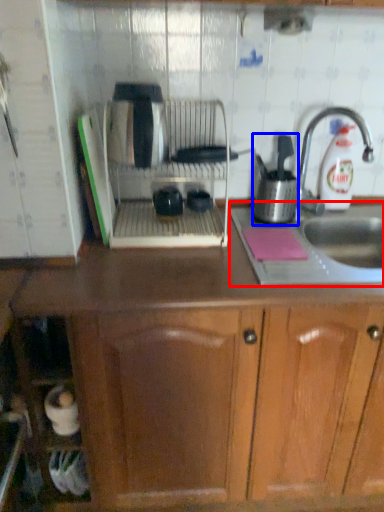
Question: Which object is closer to the camera taking this photo, sink (highlighted by a red box) or kitchen appliance (highlighted by a blue box)?

Choices:
 (A) sink
 (B) kitchen appliance

Answer: (A)